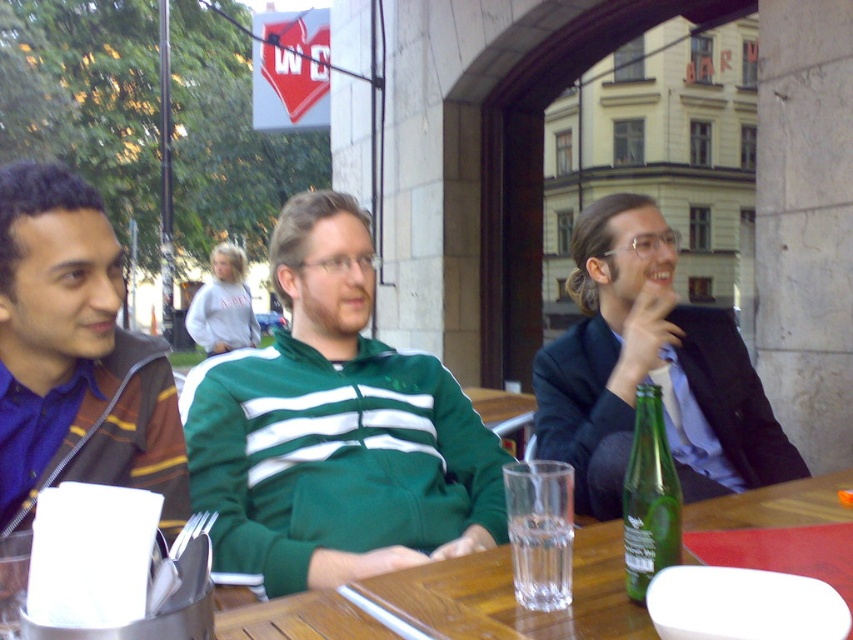
You are a photographer standing at a certain distance from the green fabric jacket at center. You want to take a closeup shot of the jacket without moving the camera. What adjustment should you make to your camera?

You should zoom in on the green fabric jacket at center since it is 5.11 feet away from the camera, which requires increasing the zoom to capture a closeup without moving the camera position.

You are a photographer trying to capture a closeup of the wooden table at center without any obstructions. The green fabric jacket at center is currently blocking your view. Can you lift the jacket to get a clear shot?

The green fabric jacket at center is positioned over wooden table at center, so lifting it would allow you to see the wooden table at center clearly.

You are standing 10 feet away from the point at coordinates point (671, 276). If you walk towards it, will you be able to reach a distance closer than 5 feet from it?

The distance of point (671, 276) from viewer is 6.40 feet. Since you are initially 10 feet away, walking towards it will reduce the distance. You can get closer than 5 feet because 6.40 is less than 10, so moving forward would allow you to reach distances as close as desired, including under 5 feet.